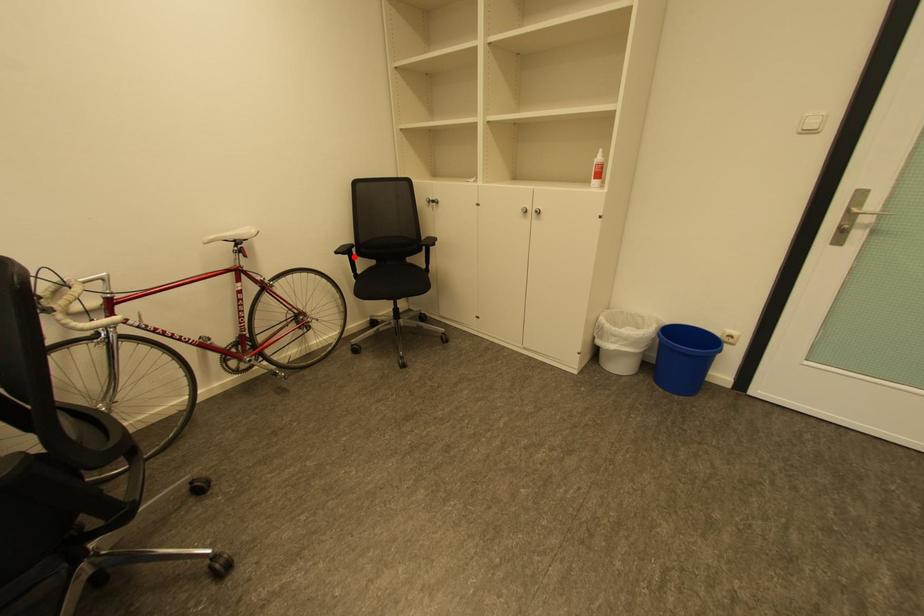
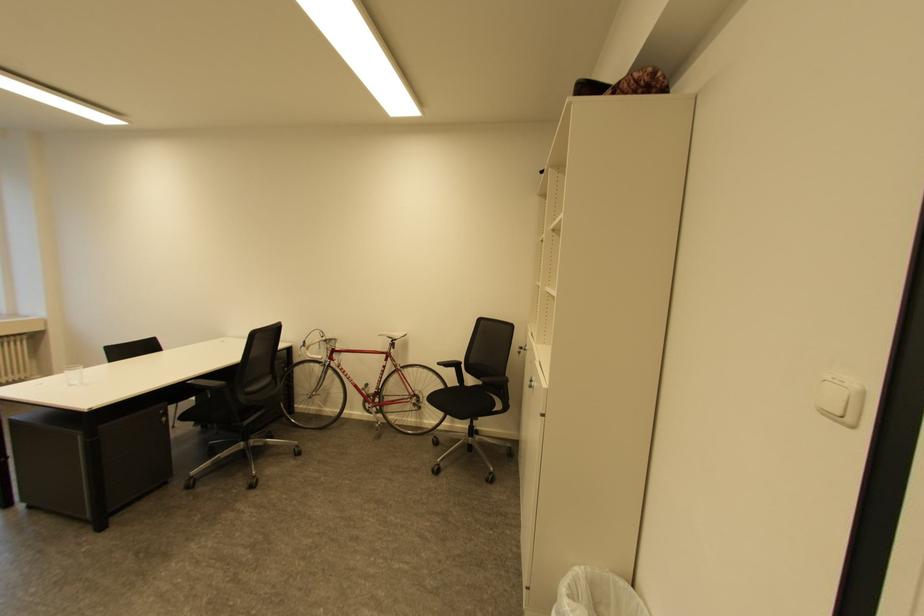
Question: I am providing you with two images of the same scene from different viewpoints. In image1, a red point is highlighted. Considering the same 3D point in image2, which of the following is correct?

Choices:
 (A) It is closer
 (B) It is farther

Answer: (B)